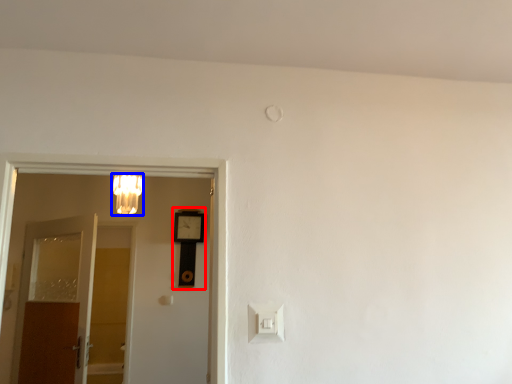
Question: Which point is further to the camera, clock (highlighted by a red box) or light fixture (highlighted by a blue box)?

Choices:
 (A) clock
 (B) light fixture

Answer: (A)